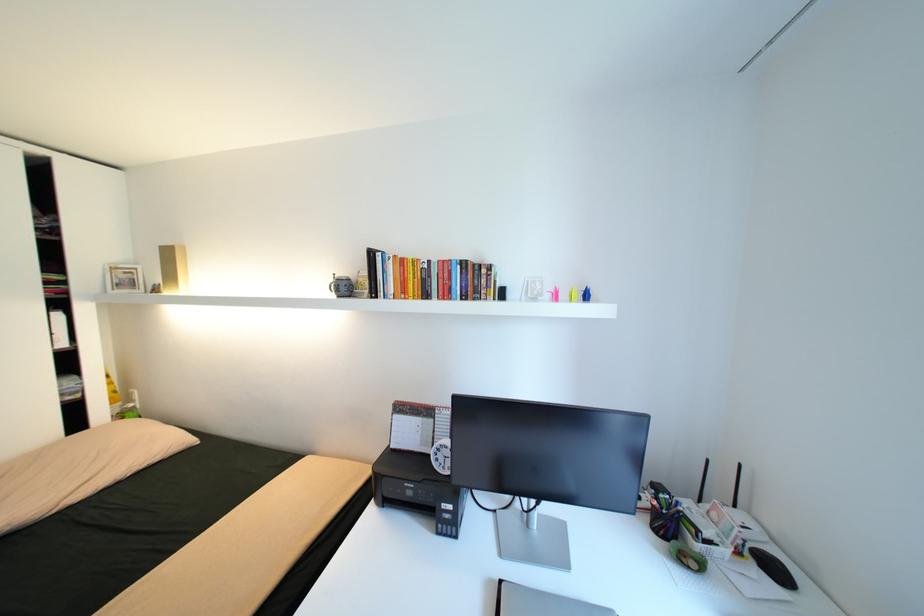
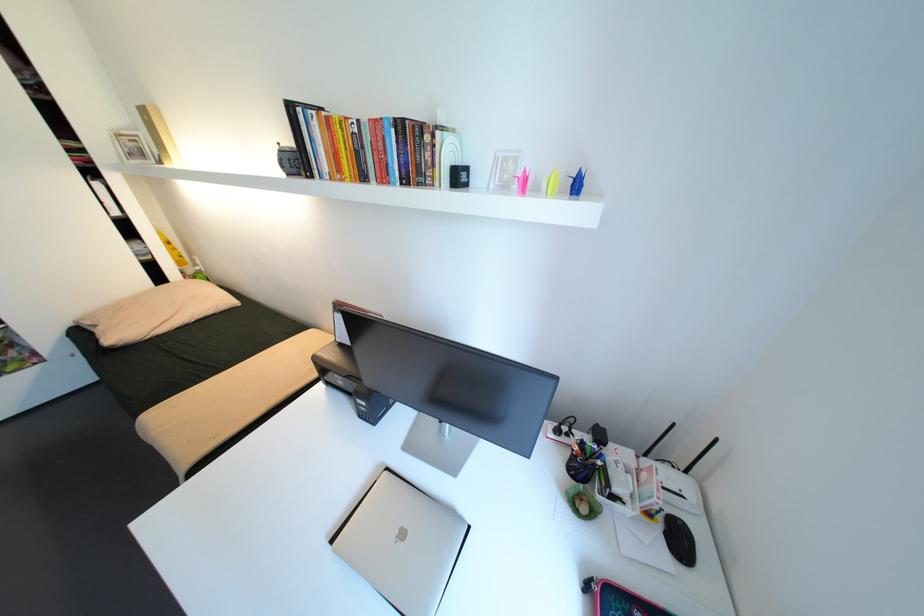
Which direction would the cameraman need to move to produce the second image?

The movement direction of the cameraman is right, forward.